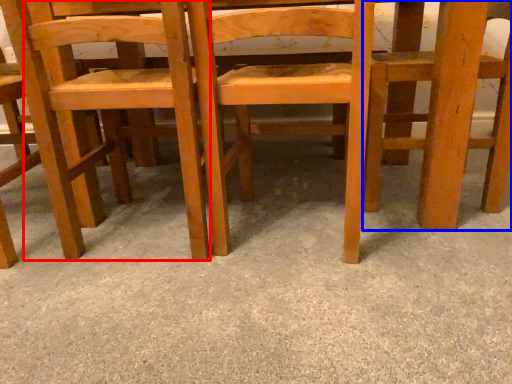
Question: Which object is further to the camera taking this photo, chair (highlighted by a red box) or chair (highlighted by a blue box)?

Choices:
 (A) chair
 (B) chair

Answer: (B)